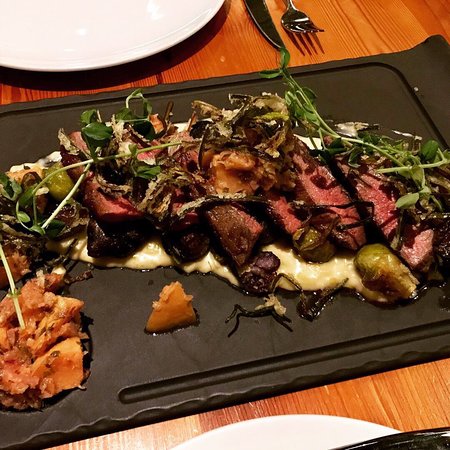
The height and width of the screenshot is (450, 450). I want to click on white plate, so click(x=67, y=30), click(x=302, y=432).